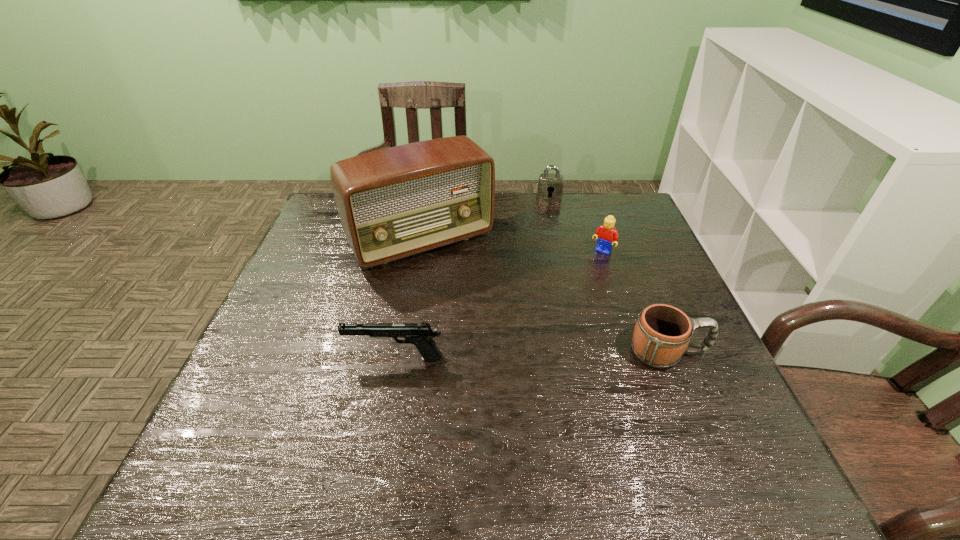
In order to click on gun in this screenshot , I will do `click(420, 334)`.

Identify the location of mug. (662, 333).

Locate an element on the screen. The height and width of the screenshot is (540, 960). the tallest object is located at coordinates [x=396, y=202].

You are a GUI agent. You are given a task and a screenshot of the screen. Output one action in this format:
    pyautogui.click(x=<x>, y=<y>)
    Task: Click on the Lego
    The width and height of the screenshot is (960, 540).
    Given the screenshot: What is the action you would take?
    pyautogui.click(x=607, y=235)

Image resolution: width=960 pixels, height=540 pixels. What are the coordinates of `padlock` in the screenshot? It's located at tap(550, 186).

Find the location of a particular element. This screenshot has height=540, width=960. the third object from left to right is located at coordinates (550, 186).

Where is `vacant area located 0.150m at the aiming end of the gun`? This screenshot has width=960, height=540. vacant area located 0.150m at the aiming end of the gun is located at coordinates (280, 358).

Identify the location of vacant space situated 0.170m at the aiming end of the gun. This screenshot has height=540, width=960. (272, 358).

Image resolution: width=960 pixels, height=540 pixels. Find the location of `vacant space located at the aiming end of the gun`. vacant space located at the aiming end of the gun is located at coordinates (303, 358).

Where is `vacant space located 0.210m on the front-facing side of the tallest object`? vacant space located 0.210m on the front-facing side of the tallest object is located at coordinates (488, 323).